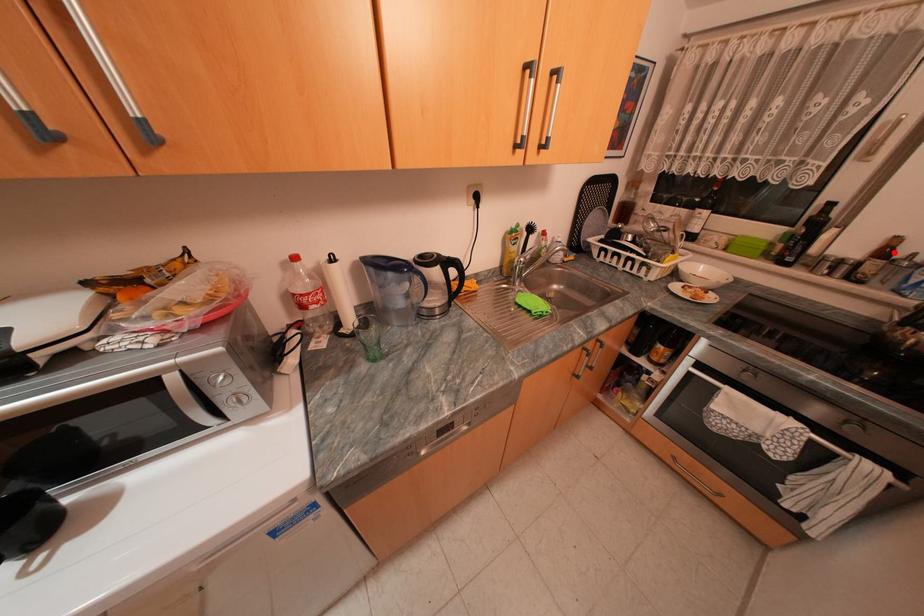
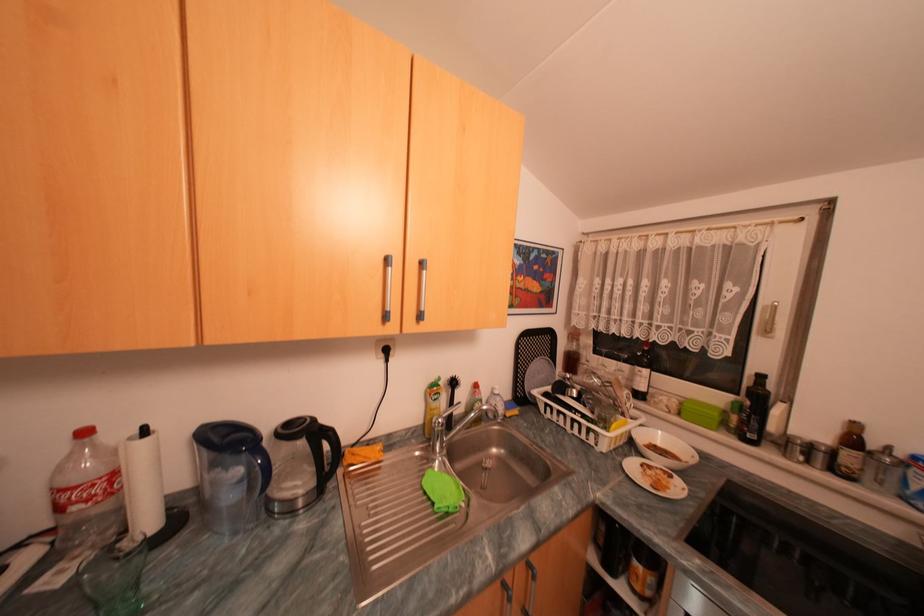
Question: I am providing you with two images of the same scene from different viewpoints. A red point is marked on the first image. At the location where the point appears in image 1, is it still visible in image 2?

Choices:
 (A) Yes
 (B) No

Answer: (A)